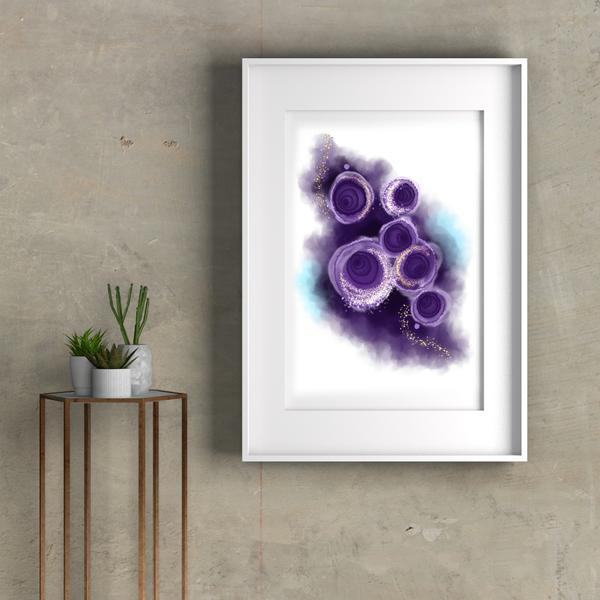
Find the location of a particular element. The height and width of the screenshot is (600, 600). green plant is located at coordinates (x=73, y=347), (x=108, y=361), (x=138, y=312).